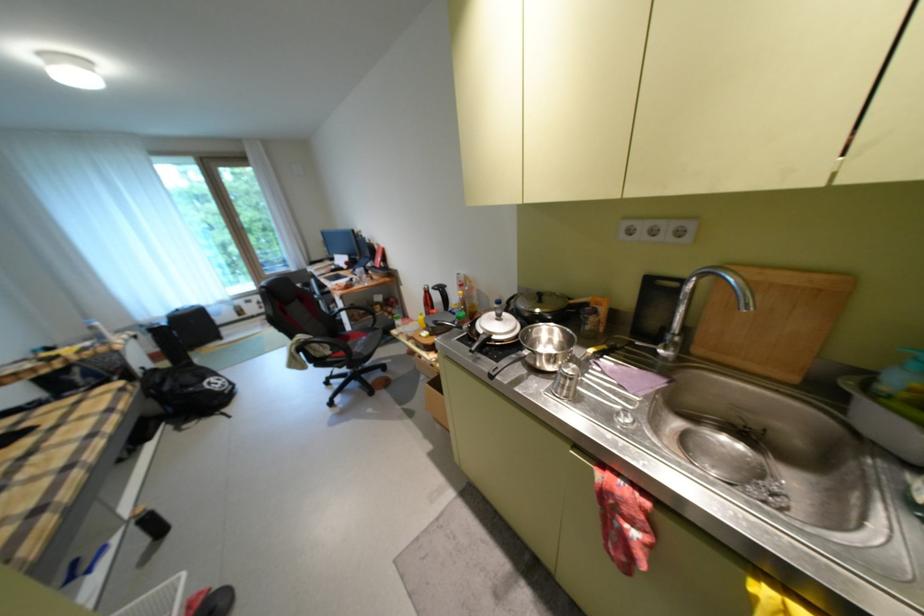
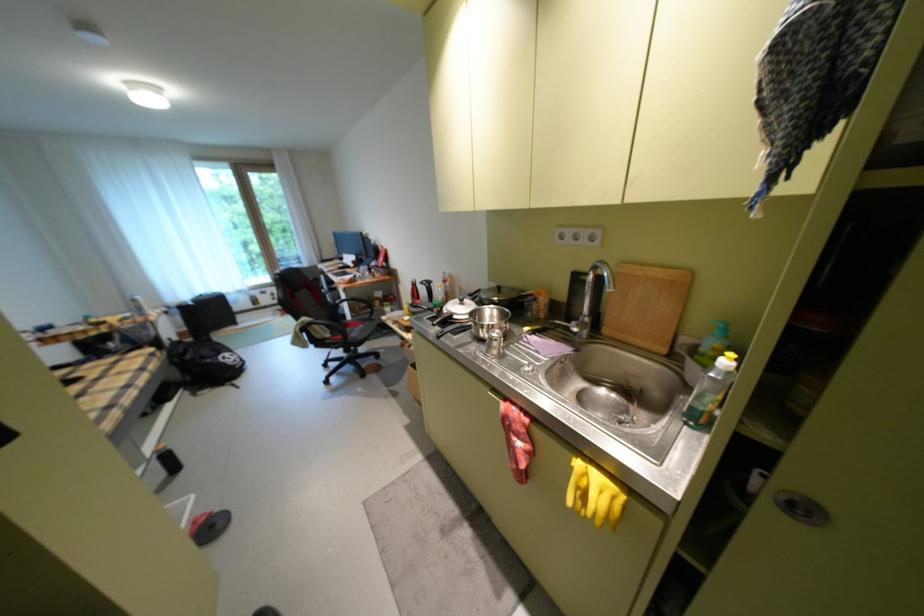
Where in the second image is the point corresponding to (x=548, y=300) from the first image?

(507, 292)